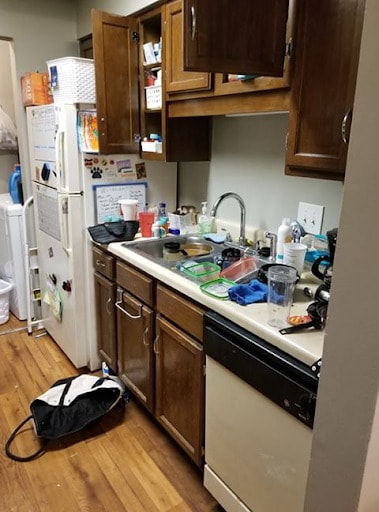
The image size is (379, 512). Find the location of `whiteboard`. whiteboard is located at coordinates (x=108, y=212).